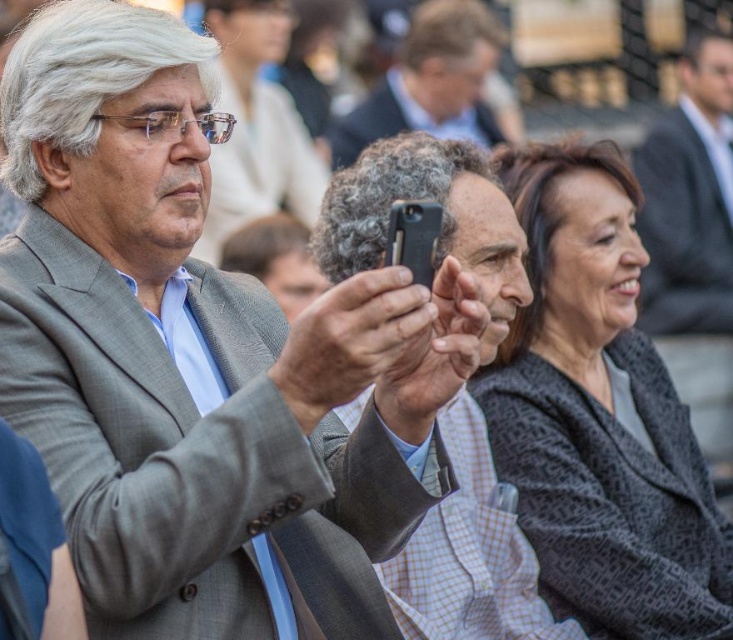
Can you confirm if dark gray textured coat at center is positioned to the right of smooth gray hair at center?

Correct, you'll find dark gray textured coat at center to the right of smooth gray hair at center.

Which is behind, point (616, 397) or point (369, 102)?

Point (369, 102)

Which is in front, point (531, 464) or point (372, 132)?

Point (531, 464) is in front.

Where is `dark gray textured coat at center`? This screenshot has width=733, height=640. dark gray textured coat at center is located at coordinates (600, 416).

Does matte gray suit at center have a larger size compared to smooth gray hair at center?

Correct, matte gray suit at center is larger in size than smooth gray hair at center.

Is matte gray suit at center to the left of smooth gray hair at center from the viewer's perspective?

Correct, you'll find matte gray suit at center to the left of smooth gray hair at center.

Identify the location of matte gray suit at center. This screenshot has height=640, width=733. (199, 358).

What do you see at coordinates (468, 552) in the screenshot? I see `matte black phone at center` at bounding box center [468, 552].

Who is higher up, matte black phone at center or smooth gray hair at center?

Positioned higher is smooth gray hair at center.

Measure the distance between matte black phone at center and camera.

matte black phone at center is 11.53 meters away from camera.

At what (x,y) coordinates should I click in order to perform the action: click on matte black phone at center. Please return your answer as a coordinate pair (x, y). Looking at the image, I should click on (468, 552).